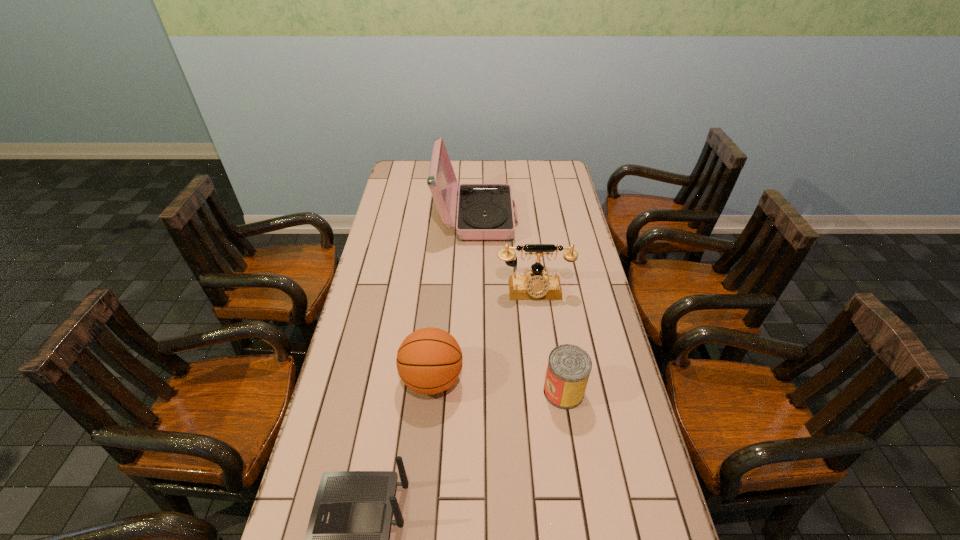
Image resolution: width=960 pixels, height=540 pixels. I want to click on can situated at the right edge, so [x=569, y=366].

The height and width of the screenshot is (540, 960). Identify the location of free location at the far edge. (515, 173).

Image resolution: width=960 pixels, height=540 pixels. I want to click on vacant space at the left edge of the desktop, so click(415, 191).

I want to click on blank area at the right edge, so click(x=627, y=435).

Where is `vacant space at the far left corner of the desktop`? This screenshot has width=960, height=540. vacant space at the far left corner of the desktop is located at coordinates (404, 175).

The height and width of the screenshot is (540, 960). I want to click on free spot between the basketball and the farthest object, so click(454, 299).

Locate an element on the screen. Image resolution: width=960 pixels, height=540 pixels. object that can be found as the fourth closest to the tallest object is located at coordinates (347, 539).

Where is `object that is the nearest to the tallest object`? The height and width of the screenshot is (540, 960). object that is the nearest to the tallest object is located at coordinates (534, 286).

The image size is (960, 540). Identify the location of free space that satisfies the following two spatial constraints: 1. with the lid open on the tallest object; 2. on the front side of the basketball. (474, 380).

Locate an element on the screen. This screenshot has width=960, height=540. free region that satisfies the following two spatial constraints: 1. on the dial of the fourth nearest object; 2. on the left side of the can is located at coordinates (546, 392).